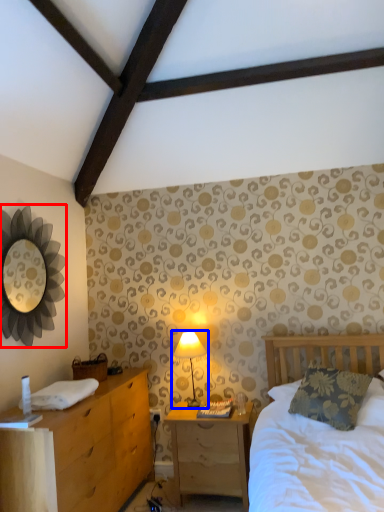
Question: Which object is closer to the camera taking this photo, mirror (highlighted by a red box) or table lamp (highlighted by a blue box)?

Choices:
 (A) mirror
 (B) table lamp

Answer: (A)